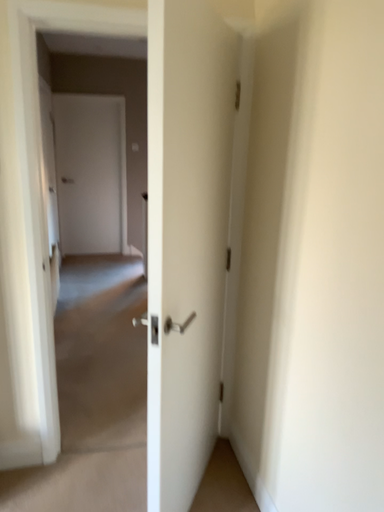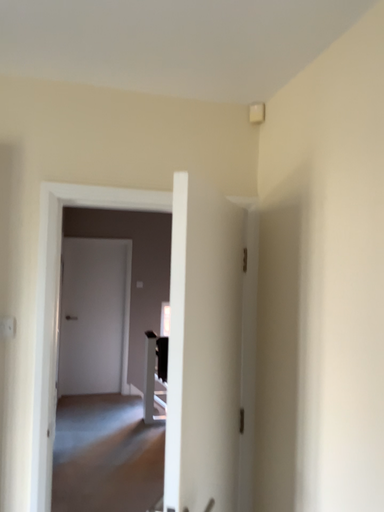
Question: Which way did the camera rotate in the video?

Choices:
 (A) rotated downward
 (B) rotated upward

Answer: (B)